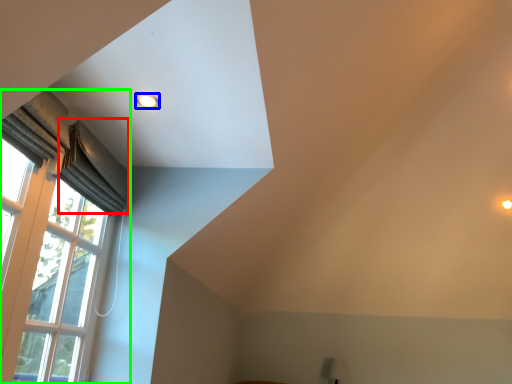
Question: Which is farther away from curtain (highlighted by a red box)? lighting (highlighted by a blue box) or window (highlighted by a green box)?

Choices:
 (A) lighting
 (B) window

Answer: (A)